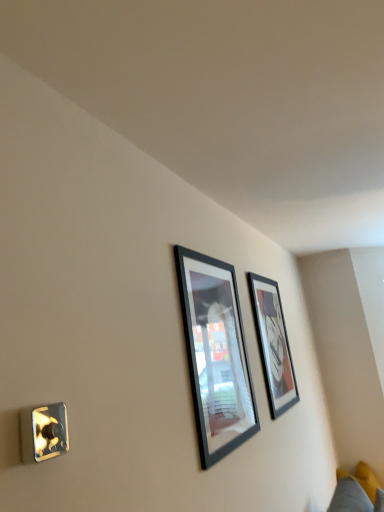
Measure the distance between point (x=227, y=382) and camera.

The distance of point (x=227, y=382) from camera is 1.71 meters.

Describe the element at coordinates (215, 354) in the screenshot. The height and width of the screenshot is (512, 384). I see `black glossy picture frame at center, acting as the second picture frame starting from the right` at that location.

In order to face yellow fabric couch at lower right, should I rotate leftwards or rightwards?

You should rotate right by 21.837 degrees.

At what (x,y) coordinates should I click in order to perform the action: click on matte black picture frame at upper center, the 2th picture frame from the left. Please return your answer as a coordinate pair (x, y). The height and width of the screenshot is (512, 384). Looking at the image, I should click on (273, 344).

Where is `black glossy picture frame at center, placed as the first picture frame when sorted from left to right`? The width and height of the screenshot is (384, 512). black glossy picture frame at center, placed as the first picture frame when sorted from left to right is located at coordinates (215, 354).

In the image, is matte black picture frame at upper center, the 2th picture frame from the left, positioned in front of or behind yellow fabric couch at lower right?

Clearly, matte black picture frame at upper center, the 2th picture frame from the left, is in front of yellow fabric couch at lower right.

Where is `couch below the matte black picture frame at upper center, positioned as the 1th picture frame in right-to-left order (from a real-world perspective)`? Image resolution: width=384 pixels, height=512 pixels. couch below the matte black picture frame at upper center, positioned as the 1th picture frame in right-to-left order (from a real-world perspective) is located at coordinates (356, 490).

Is matte black picture frame at upper center, the 2th picture frame from the left, wider than yellow fabric couch at lower right?

No.

Does point (265, 309) appear closer or farther from the camera than point (371, 484)?

Point (265, 309) is positioned closer to the camera compared to point (371, 484).

Consider the image. Can you confirm if yellow fabric couch at lower right is bigger than black glossy picture frame at center, placed as the first picture frame when sorted from left to right?

Correct, yellow fabric couch at lower right is larger in size than black glossy picture frame at center, placed as the first picture frame when sorted from left to right.

At what (x,y) coordinates should I click in order to perform the action: click on couch below the black glossy picture frame at center, acting as the second picture frame starting from the right (from a real-world perspective). Please return your answer as a coordinate pair (x, y). Looking at the image, I should click on (356, 490).

Is point (348, 486) closer or farther from the camera than point (187, 308)?

Point (348, 486).

Is black glossy picture frame at center, placed as the first picture frame when sorted from left to right, a part of yellow fabric couch at lower right?

That's incorrect, black glossy picture frame at center, placed as the first picture frame when sorted from left to right, is not inside yellow fabric couch at lower right.

Does yellow fabric couch at lower right have a lesser width compared to matte black picture frame at upper center, the 2th picture frame from the left?

In fact, yellow fabric couch at lower right might be wider than matte black picture frame at upper center, the 2th picture frame from the left.

From a real-world perspective, which object stands above the other?

matte black picture frame at upper center, which is the 1th picture frame in back-to-front order, is physically above.

Would you consider yellow fabric couch at lower right to be distant from matte black picture frame at upper center, which appears as the 2th picture frame when viewed from the front?

Absolutely, yellow fabric couch at lower right is distant from matte black picture frame at upper center, which appears as the 2th picture frame when viewed from the front.

Measure the distance from yellow fabric couch at lower right to matte black picture frame at upper center, the 2th picture frame from the left.

They are 1.18 meters apart.

Is black glossy picture frame at center, placed as the first picture frame when sorted from left to right, surrounded by matte black picture frame at upper center, the 2th picture frame from the left?

That's incorrect, black glossy picture frame at center, placed as the first picture frame when sorted from left to right, is not inside matte black picture frame at upper center, the 2th picture frame from the left.

Is point (271, 333) closer or farther from the camera than point (246, 362)?

Point (271, 333) appears to be farther away from the viewer than point (246, 362).

Is the position of matte black picture frame at upper center, which is the 1th picture frame in back-to-front order, less distant than that of black glossy picture frame at center, the second picture frame from the back?

No, matte black picture frame at upper center, which is the 1th picture frame in back-to-front order, is further to the viewer.

In terms of width, does matte black picture frame at upper center, which appears as the 2th picture frame when viewed from the front, look wider or thinner when compared to black glossy picture frame at center, acting as the second picture frame starting from the right?

In the image, matte black picture frame at upper center, which appears as the 2th picture frame when viewed from the front, appears to be wider than black glossy picture frame at center, acting as the second picture frame starting from the right.

Is point (234, 336) farther from viewer compared to point (275, 359)?

No, it is in front of (275, 359).

Is black glossy picture frame at center, placed as the first picture frame when sorted from left to right, not inside matte black picture frame at upper center, the 2th picture frame from the left?

black glossy picture frame at center, placed as the first picture frame when sorted from left to right, is positioned outside matte black picture frame at upper center, the 2th picture frame from the left.

Find the location of a particular element. The width and height of the screenshot is (384, 512). picture frame on the left side of matte black picture frame at upper center, the 2th picture frame from the left is located at coordinates (215, 354).

Which object is more forward, black glossy picture frame at center, acting as the second picture frame starting from the right, or matte black picture frame at upper center, positioned as the 1th picture frame in right-to-left order?

black glossy picture frame at center, acting as the second picture frame starting from the right, is in front.

Based on the photo, which of these two, black glossy picture frame at center, the first picture frame from the front, or yellow fabric couch at lower right, is smaller?

black glossy picture frame at center, the first picture frame from the front, is smaller.

In terms of width, does black glossy picture frame at center, the first picture frame from the front, look wider or thinner when compared to yellow fabric couch at lower right?

black glossy picture frame at center, the first picture frame from the front, is thinner than yellow fabric couch at lower right.

Can we say black glossy picture frame at center, placed as the first picture frame when sorted from left to right, lies outside yellow fabric couch at lower right?

Yes, black glossy picture frame at center, placed as the first picture frame when sorted from left to right, is not within yellow fabric couch at lower right.

What's the angular difference between black glossy picture frame at center, the second picture frame from the back, and yellow fabric couch at lower right's facing directions?

91.7 degrees separate the facing orientations of black glossy picture frame at center, the second picture frame from the back, and yellow fabric couch at lower right.

Find the location of a particular element. couch below the matte black picture frame at upper center, positioned as the 1th picture frame in right-to-left order (from the image's perspective) is located at coordinates (356, 490).

From a real-world perspective, which picture frame is the 1st one above the yellow fabric couch at lower right? Please provide its 2D coordinates.

[(215, 354)]

From the image, which object appears to be farther from matte black picture frame at upper center, which is the 1th picture frame in back-to-front order, black glossy picture frame at center, placed as the first picture frame when sorted from left to right, or yellow fabric couch at lower right?

Among the two, yellow fabric couch at lower right is located further to matte black picture frame at upper center, which is the 1th picture frame in back-to-front order.

When comparing their distances from black glossy picture frame at center, acting as the second picture frame starting from the right, does matte black picture frame at upper center, the 2th picture frame from the left, or yellow fabric couch at lower right seem further?

yellow fabric couch at lower right is further to black glossy picture frame at center, acting as the second picture frame starting from the right.

Based on the photo, from the image, which object appears to be nearer to matte black picture frame at upper center, which is the 1th picture frame in back-to-front order, yellow fabric couch at lower right or black glossy picture frame at center, placed as the first picture frame when sorted from left to right?

The object closer to matte black picture frame at upper center, which is the 1th picture frame in back-to-front order, is black glossy picture frame at center, placed as the first picture frame when sorted from left to right.

Based on their spatial positions, is yellow fabric couch at lower right or matte black picture frame at upper center, which is the 1th picture frame in back-to-front order, closer to black glossy picture frame at center, the first picture frame from the front?

Based on the image, matte black picture frame at upper center, which is the 1th picture frame in back-to-front order, appears to be nearer to black glossy picture frame at center, the first picture frame from the front.

Which object lies nearer to the anchor point yellow fabric couch at lower right, matte black picture frame at upper center, which appears as the 2th picture frame when viewed from the front, or black glossy picture frame at center, the second picture frame from the back?

matte black picture frame at upper center, which appears as the 2th picture frame when viewed from the front, is closer to yellow fabric couch at lower right.

Based on their spatial positions, is black glossy picture frame at center, the first picture frame from the front, or matte black picture frame at upper center, the 2th picture frame from the left, closer to yellow fabric couch at lower right?

matte black picture frame at upper center, the 2th picture frame from the left, is positioned closer to the anchor yellow fabric couch at lower right.

Find the location of a particular element. The height and width of the screenshot is (512, 384). picture frame between black glossy picture frame at center, acting as the second picture frame starting from the right, and yellow fabric couch at lower right, along the z-axis is located at coordinates (273, 344).